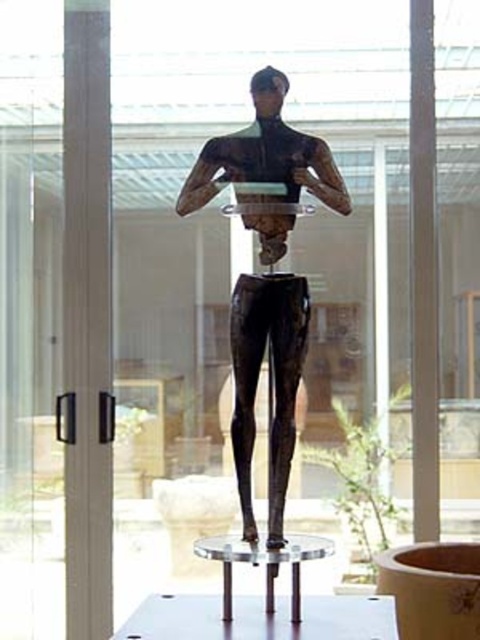
Does bronze statue at center have a lesser height compared to white glossy table at center?

In fact, bronze statue at center may be taller than white glossy table at center.

Is point (244, 172) positioned after point (387, 611)?

Yes, it is.

Describe the element at coordinates (266, 276) in the screenshot. I see `bronze statue at center` at that location.

Locate an element on the screen. This screenshot has width=480, height=640. bronze statue at center is located at coordinates (266, 276).

Is white glossy table at center smaller than green leafy plant at lower center?

Actually, white glossy table at center might be larger than green leafy plant at lower center.

Who is shorter, white glossy table at center or green leafy plant at lower center?

white glossy table at center is shorter.

Identify the location of white glossy table at center. The image size is (480, 640). (261, 618).

The width and height of the screenshot is (480, 640). Identify the location of white glossy table at center. (261, 618).

Is bronze statue at center closer to camera compared to green leafy plant at lower center?

Yes, bronze statue at center is closer to the viewer.

Does bronze statue at center have a greater width compared to green leafy plant at lower center?

Indeed, bronze statue at center has a greater width compared to green leafy plant at lower center.

Which is in front, point (285, 541) or point (356, 426)?

Point (285, 541)

This screenshot has height=640, width=480. I want to click on bronze statue at center, so click(x=266, y=276).